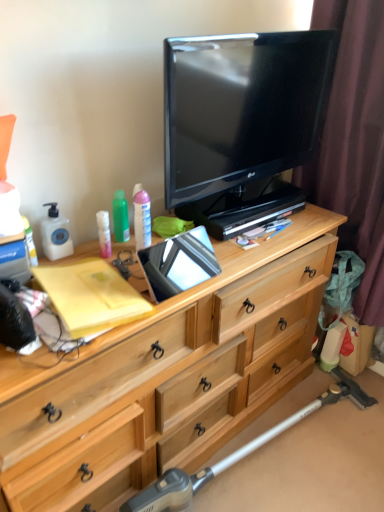
Question: Considering the relative sizes of brown fabric curtain at right and matte plastic lotion at center, which is counted as the 1th toiletry, starting from the right, in the image provided, is brown fabric curtain at right bigger than matte plastic lotion at center, which is counted as the 1th toiletry, starting from the right,?

Choices:
 (A) yes
 (B) no

Answer: (A)

Question: Can you confirm if brown fabric curtain at right is wider than matte plastic lotion at center, the third toiletry viewed from the left?

Choices:
 (A) yes
 (B) no

Answer: (A)

Question: Can matte plastic lotion at center, the third toiletry viewed from the left, be found inside brown fabric curtain at right?

Choices:
 (A) no
 (B) yes

Answer: (A)

Question: Does brown fabric curtain at right touch matte plastic lotion at center, the third toiletry viewed from the left?

Choices:
 (A) yes
 (B) no

Answer: (B)

Question: Does brown fabric curtain at right appear on the left side of matte plastic lotion at center, the third toiletry viewed from the left?

Choices:
 (A) no
 (B) yes

Answer: (A)

Question: Does brown fabric curtain at right turn towards matte plastic lotion at center, which is counted as the 1th toiletry, starting from the right?

Choices:
 (A) yes
 (B) no

Answer: (A)

Question: Does matte plastic lotion at left, which is counted as the 1th toiletry, starting from the left, lie behind metallic silver vacuum cleaner at lower right?

Choices:
 (A) yes
 (B) no

Answer: (A)

Question: From the image's perspective, is matte plastic lotion at left, arranged as the third toiletry when viewed from the right, beneath metallic silver vacuum cleaner at lower right?

Choices:
 (A) yes
 (B) no

Answer: (B)

Question: Is matte plastic lotion at left, arranged as the third toiletry when viewed from the right, to the left of metallic silver vacuum cleaner at lower right from the viewer's perspective?

Choices:
 (A) yes
 (B) no

Answer: (A)

Question: Does matte plastic lotion at left, arranged as the third toiletry when viewed from the right, appear on the right side of metallic silver vacuum cleaner at lower right?

Choices:
 (A) yes
 (B) no

Answer: (B)

Question: From the image's perspective, is matte plastic lotion at left, arranged as the third toiletry when viewed from the right, above metallic silver vacuum cleaner at lower right?

Choices:
 (A) no
 (B) yes

Answer: (B)

Question: Is matte plastic lotion at left, which is counted as the 1th toiletry, starting from the left, bigger than metallic silver vacuum cleaner at lower right?

Choices:
 (A) no
 (B) yes

Answer: (A)

Question: Is matte plastic lotion at center, which is counted as the 1th toiletry, starting from the right, shorter than metallic silver vacuum cleaner at lower right?

Choices:
 (A) no
 (B) yes

Answer: (B)